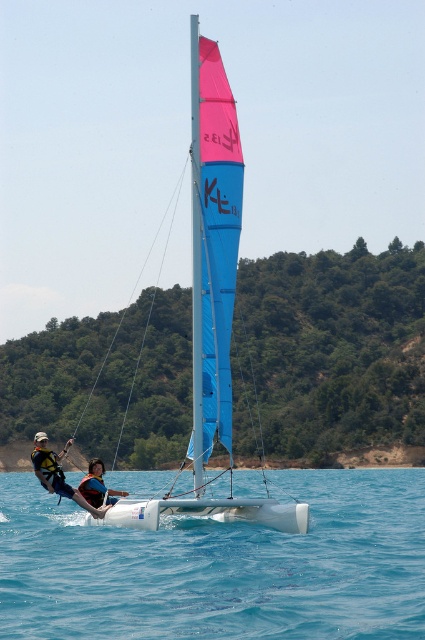
Question: Which of the following is the farthest from the observer?

Choices:
 (A) (85, 502)
 (B) (198, 113)
 (C) (331, 477)
 (D) (99, 477)

Answer: (C)

Question: Is blue fabric sailboat at center smaller than blue glossy sail at center?

Choices:
 (A) no
 (B) yes

Answer: (B)

Question: Observing the image, what is the correct spatial positioning of blue glossy sail at center in reference to white life vest at lower left?

Choices:
 (A) below
 (B) above

Answer: (B)

Question: Which point appears closest to the camera in this image?

Choices:
 (A) (144, 541)
 (B) (231, 259)
 (C) (48, 476)
 (D) (198, 333)

Answer: (B)

Question: Which object is positioned farthest from the clear blue water at center?

Choices:
 (A) white life vest at lower left
 (B) orange life vest at center
 (C) blue glossy sail at center
 (D) blue fabric sailboat at center

Answer: (A)

Question: Can you confirm if blue fabric sailboat at center is thinner than white life vest at lower left?

Choices:
 (A) no
 (B) yes

Answer: (B)